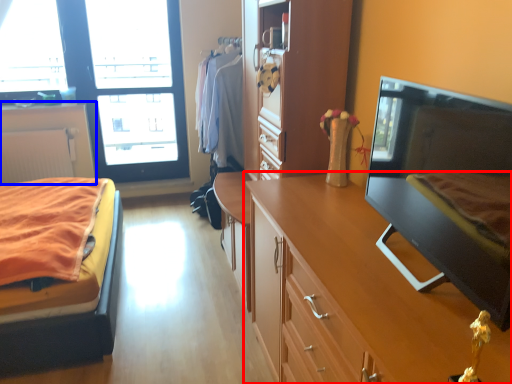
Question: Which point is further to the camera, cabinetry (highlighted by a red box) or cabinetry (highlighted by a blue box)?

Choices:
 (A) cabinetry
 (B) cabinetry

Answer: (B)